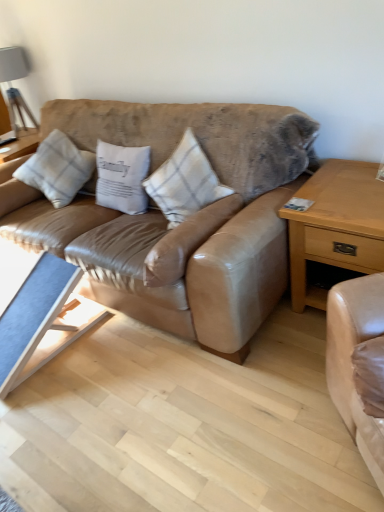
The width and height of the screenshot is (384, 512). I want to click on blank space situated above light brown wood nightstand at right (from a real-world perspective), so point(352,185).